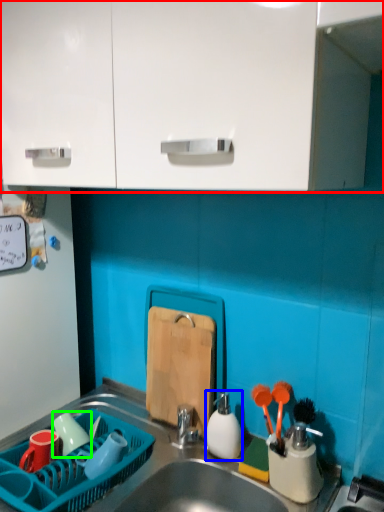
Question: Which object is the closest to the cabinetry (highlighted by a red box)? Choose among these: tableware (highlighted by a blue box) or tableware (highlighted by a green box).

Choices:
 (A) tableware
 (B) tableware

Answer: (A)